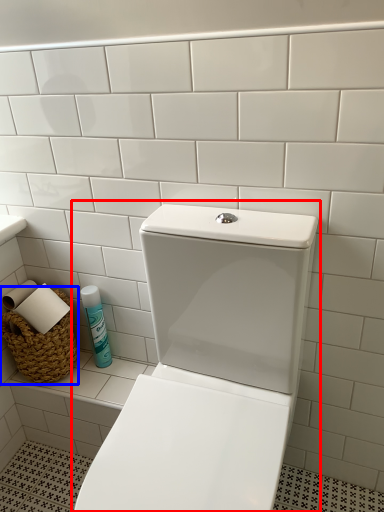
Question: Which object appears closest to the camera in this image, toilet (highlighted by a red box) or basket (highlighted by a blue box)?

Choices:
 (A) toilet
 (B) basket

Answer: (A)